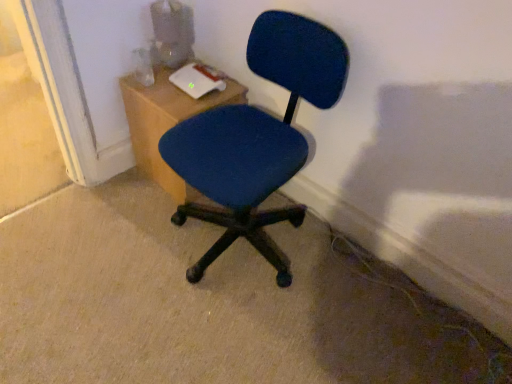
Where is `free spot in front of blue fabric chair at center`? Image resolution: width=512 pixels, height=384 pixels. free spot in front of blue fabric chair at center is located at coordinates (225, 337).